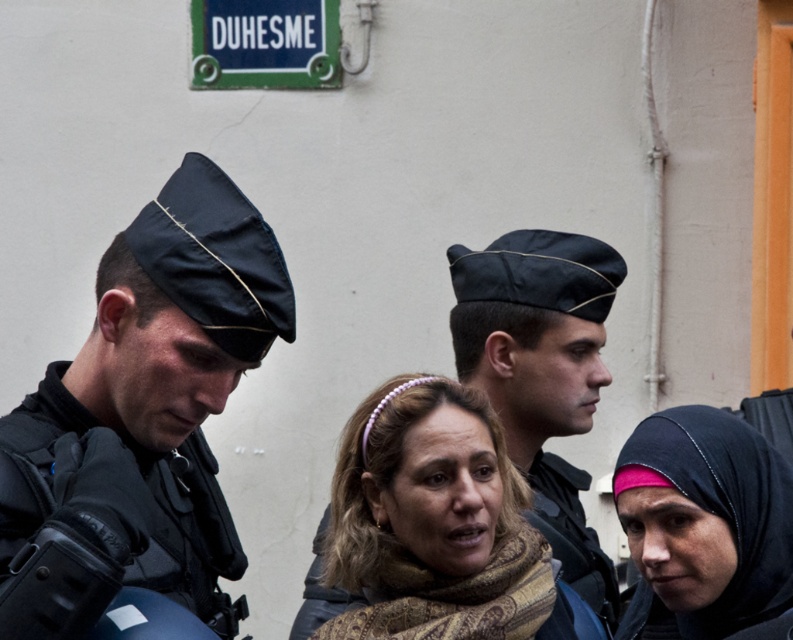
You are a photographer standing 3 meters away from the two men and the woman. You want to take a photo that includes both the brown textured scarf at center and the pink satin hijab at center. Given that your camera has a maximum focus range of 2 meters, will you be able to capture both items clearly in the same frame?

The brown textured scarf at center is 2.21 meters from the pink satin hijab at center. Since your camera can only focus within 2 meters, the distance between them exceeds the focus range. Therefore, you won me be able to capture both clearly in the same frame.

You are a drone operator trying to navigate between two points in the scene. The first point is at coordinates point (401, 538) and the second point is at point (646, 547). Which point is closer to your drone if you are flying directly above the scene?

Point (401, 538) is further to the viewer than point (646, 547), so the second point is closer to the drone.